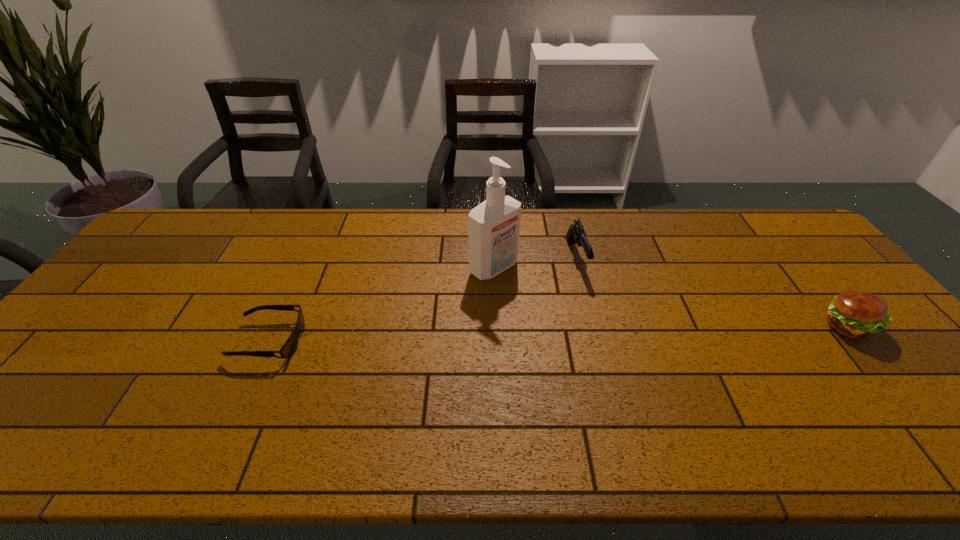
Where is `vacant space located 0.140m on the front label of the cleansing agent`? The height and width of the screenshot is (540, 960). vacant space located 0.140m on the front label of the cleansing agent is located at coordinates (545, 305).

The width and height of the screenshot is (960, 540). I want to click on vacant space located on the front label of the cleansing agent, so click(x=604, y=348).

At what (x,y) coordinates should I click in order to perform the action: click on vacant position located 0.200m on the front label of the cleansing agent. Please return your answer as a coordinate pair (x, y). The height and width of the screenshot is (540, 960). Looking at the image, I should click on (562, 317).

Where is `vacant region located at the end of the barrel of the fourth object from left to right`? Image resolution: width=960 pixels, height=540 pixels. vacant region located at the end of the barrel of the fourth object from left to right is located at coordinates (605, 339).

Identify the location of free space located at the end of the barrel of the fourth object from left to right. The height and width of the screenshot is (540, 960). (613, 364).

The height and width of the screenshot is (540, 960). What are the coordinates of `blank space located 0.390m at the end of the barrel of the fourth object from left to right` in the screenshot? It's located at (626, 395).

Locate an element on the screen. vacant space located 0.100m on the face of the farthest object is located at coordinates (499, 238).

This screenshot has height=540, width=960. Find the location of `vacant area located on the face of the farthest object`. vacant area located on the face of the farthest object is located at coordinates point(509,278).

This screenshot has width=960, height=540. I want to click on vacant space located 0.370m on the face of the farthest object, so click(x=513, y=295).

Find the location of a particular element. gun located in the far edge section of the desktop is located at coordinates (576, 234).